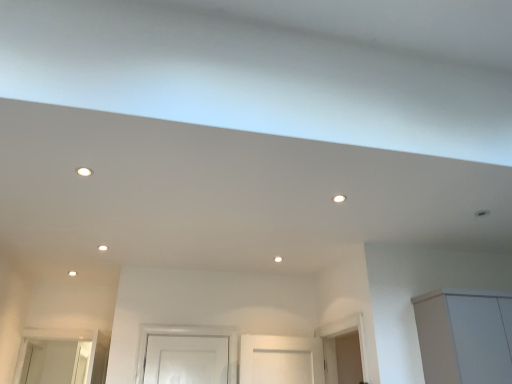
The height and width of the screenshot is (384, 512). What do you see at coordinates (84, 171) in the screenshot?
I see `white glossy light fixture at upper left, the second lighting in the bottom-to-top sequence` at bounding box center [84, 171].

The image size is (512, 384). What are the coordinates of `white matte cabinet at lower right` in the screenshot? It's located at (465, 336).

Locate an element on the screen. The image size is (512, 384). white glossy light fixture at upper left, arranged as the first lighting when viewed from the left is located at coordinates (84, 171).

From the image's perspective, is matte white light fixture at center, positioned as the first lighting in bottom-to-top order, located above white glossy light fixture at upper left, placed as the 2th lighting when sorted from right to left?

Incorrect, from the image's perspective, matte white light fixture at center, positioned as the first lighting in bottom-to-top order, is lower than white glossy light fixture at upper left, placed as the 2th lighting when sorted from right to left.

Can we say matte white light fixture at center, the second lighting viewed from the top, lies outside white glossy light fixture at upper left, the 2th lighting in the back-to-front sequence?

That's correct, matte white light fixture at center, the second lighting viewed from the top, is outside of white glossy light fixture at upper left, the 2th lighting in the back-to-front sequence.

Considering the relative sizes of matte white light fixture at center, positioned as the first lighting in bottom-to-top order, and white glossy light fixture at upper left, marked as the first lighting in a top-to-bottom arrangement, in the image provided, is matte white light fixture at center, positioned as the first lighting in bottom-to-top order, taller than white glossy light fixture at upper left, marked as the first lighting in a top-to-bottom arrangement,?

Correct, matte white light fixture at center, positioned as the first lighting in bottom-to-top order, is much taller as white glossy light fixture at upper left, marked as the first lighting in a top-to-bottom arrangement.

In terms of width, does matte white light fixture at center, positioned as the first lighting in bottom-to-top order, look wider or thinner when compared to white glossy light fixture at upper left, arranged as the first lighting when viewed from the left?

Considering their sizes, matte white light fixture at center, positioned as the first lighting in bottom-to-top order, looks slimmer than white glossy light fixture at upper left, arranged as the first lighting when viewed from the left.

Is point (80, 170) positioned before point (467, 318)?

Yes, point (80, 170) is closer to viewer.

In the image, is white glossy light fixture at upper left, marked as the first lighting in a top-to-bottom arrangement, positioned in front of or behind white matte cabinet at lower right?

white glossy light fixture at upper left, marked as the first lighting in a top-to-bottom arrangement, is in front of white matte cabinet at lower right.

Consider the image. How different are the orientations of white glossy light fixture at upper left, arranged as the first lighting when viewed from the left, and white matte cabinet at lower right in degrees?

88.1 degrees.

Which is correct: white glossy light fixture at upper left, placed as the 2th lighting when sorted from right to left, is inside white matte cabinet at lower right, or outside of it?

white glossy light fixture at upper left, placed as the 2th lighting when sorted from right to left, is outside white matte cabinet at lower right.

In the scene shown: How many degrees apart are the facing directions of matte white light fixture at center, placed as the 2th lighting when sorted from left to right, and white matte cabinet at lower right?

They differ by 90.1 degrees in their facing directions.

Who is smaller, matte white light fixture at center, the second lighting viewed from the top, or white matte cabinet at lower right?

Smaller between the two is matte white light fixture at center, the second lighting viewed from the top.

Could you tell me if matte white light fixture at center, which is the 1th lighting from right to left, is turned towards white matte cabinet at lower right?

No, matte white light fixture at center, which is the 1th lighting from right to left, is not facing towards white matte cabinet at lower right.

From the image's perspective, is white glossy light fixture at upper left, placed as the 2th lighting when sorted from right to left, located above or below matte white light fixture at center, placed as the 2th lighting when sorted from left to right?

white glossy light fixture at upper left, placed as the 2th lighting when sorted from right to left, is situated higher than matte white light fixture at center, placed as the 2th lighting when sorted from left to right, in the image.

Considering the sizes of white glossy light fixture at upper left, arranged as the first lighting when viewed from the left, and matte white light fixture at center, which is the 1th lighting from right to left, in the image, is white glossy light fixture at upper left, arranged as the first lighting when viewed from the left, taller or shorter than matte white light fixture at center, which is the 1th lighting from right to left,?

Considering their sizes, white glossy light fixture at upper left, arranged as the first lighting when viewed from the left, has less height than matte white light fixture at center, which is the 1th lighting from right to left.

Is white glossy light fixture at upper left, placed as the 2th lighting when sorted from right to left, not close to matte white light fixture at center, positioned as the first lighting in bottom-to-top order?

white glossy light fixture at upper left, placed as the 2th lighting when sorted from right to left, is far away from matte white light fixture at center, positioned as the first lighting in bottom-to-top order.

Is white glossy light fixture at upper left, marked as the first lighting in a top-to-bottom arrangement, looking in the opposite direction of matte white light fixture at center, the second lighting viewed from the top?

No, white glossy light fixture at upper left, marked as the first lighting in a top-to-bottom arrangement, is not facing away from matte white light fixture at center, the second lighting viewed from the top.

Based on the photo, is white matte cabinet at lower right to the right of white glossy light fixture at upper left, the second lighting in the bottom-to-top sequence, from the viewer's perspective?

Correct, you'll find white matte cabinet at lower right to the right of white glossy light fixture at upper left, the second lighting in the bottom-to-top sequence.

Between white matte cabinet at lower right and white glossy light fixture at upper left, placed as the 2th lighting when sorted from right to left, which one has larger size?

Bigger between the two is white matte cabinet at lower right.

Looking at this image, which is correct: white matte cabinet at lower right is inside white glossy light fixture at upper left, placed as the 2th lighting when sorted from right to left, or outside of it?

white matte cabinet at lower right is not enclosed by white glossy light fixture at upper left, placed as the 2th lighting when sorted from right to left.

Which object is more forward, white matte cabinet at lower right or matte white light fixture at center, positioned as the first lighting in bottom-to-top order?

matte white light fixture at center, positioned as the first lighting in bottom-to-top order, is closer to the camera.

Is white matte cabinet at lower right situated inside matte white light fixture at center, the second lighting viewed from the top, or outside?

white matte cabinet at lower right is outside matte white light fixture at center, the second lighting viewed from the top.

From a real-world perspective, is white matte cabinet at lower right below matte white light fixture at center, positioned as the first lighting in bottom-to-top order?

Yes, from a real-world perspective, white matte cabinet at lower right is under matte white light fixture at center, positioned as the first lighting in bottom-to-top order.

Is white matte cabinet at lower right turned away from matte white light fixture at center, which is the 2th lighting in front-to-back order?

white matte cabinet at lower right does not have its back to matte white light fixture at center, which is the 2th lighting in front-to-back order.

What are the coordinates of `lighting located behind the white glossy light fixture at upper left, arranged as the first lighting when viewed from the left` in the screenshot? It's located at (339, 198).

At what (x,y) coordinates should I click in order to perform the action: click on cabinetry lying below the white glossy light fixture at upper left, the 2th lighting in the back-to-front sequence (from the image's perspective). Please return your answer as a coordinate pair (x, y). Image resolution: width=512 pixels, height=384 pixels. Looking at the image, I should click on (465, 336).

Which object lies further to the anchor point white glossy light fixture at upper left, the 2th lighting in the back-to-front sequence, matte white light fixture at center, placed as the 2th lighting when sorted from left to right, or white matte cabinet at lower right?

white matte cabinet at lower right.

From the image, which object appears to be farther from white glossy light fixture at upper left, the second lighting in the bottom-to-top sequence, white matte cabinet at lower right or matte white light fixture at center, which ranks as the 1th lighting in back-to-front order?

white matte cabinet at lower right is positioned further to the anchor white glossy light fixture at upper left, the second lighting in the bottom-to-top sequence.

Based on their spatial positions, is white matte cabinet at lower right or white glossy light fixture at upper left, which appears as the 1th lighting when viewed from the front, closer to matte white light fixture at center, the second lighting viewed from the top?

white matte cabinet at lower right lies closer to matte white light fixture at center, the second lighting viewed from the top, than the other object.

Estimate the real-world distances between objects in this image. Which object is closer to matte white light fixture at center, placed as the 2th lighting when sorted from left to right, white glossy light fixture at upper left, arranged as the first lighting when viewed from the left, or white matte cabinet at lower right?

white matte cabinet at lower right lies closer to matte white light fixture at center, placed as the 2th lighting when sorted from left to right, than the other object.

Looking at the image, which one is located further to white matte cabinet at lower right, white glossy light fixture at upper left, which appears as the 1th lighting when viewed from the front, or matte white light fixture at center, positioned as the first lighting in bottom-to-top order?

The object further to white matte cabinet at lower right is white glossy light fixture at upper left, which appears as the 1th lighting when viewed from the front.

Based on their spatial positions, is matte white light fixture at center, the second lighting viewed from the top, or white glossy light fixture at upper left, arranged as the first lighting when viewed from the left, closer to white matte cabinet at lower right?

matte white light fixture at center, the second lighting viewed from the top, is closer to white matte cabinet at lower right.

At what (x,y) coordinates should I click in order to perform the action: click on lighting between white glossy light fixture at upper left, the second lighting in the bottom-to-top sequence, and white matte cabinet at lower right. Please return your answer as a coordinate pair (x, y). The width and height of the screenshot is (512, 384). Looking at the image, I should click on (339, 198).